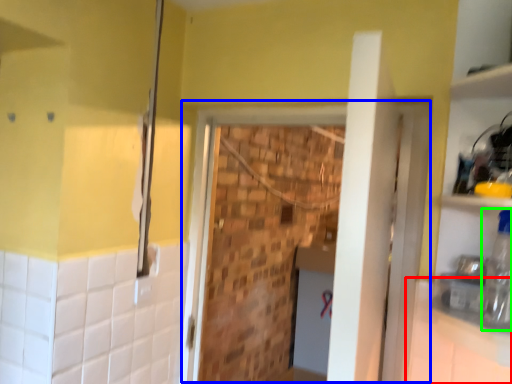
Question: Which object is positioned farthest from counter top (highlighted by a red box)? Select from screen door (highlighted by a blue box) and bottle (highlighted by a green box).

Choices:
 (A) screen door
 (B) bottle

Answer: (A)